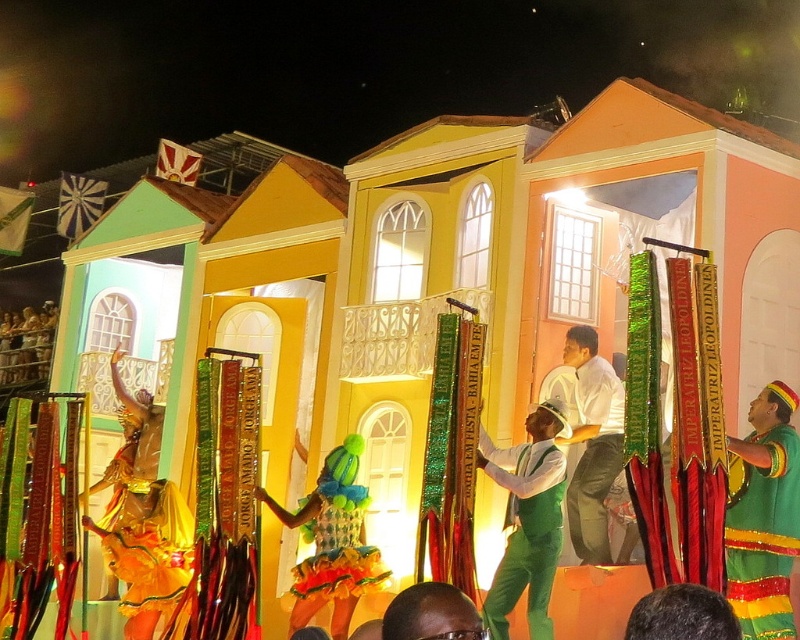
You are a photographer standing at the camera position trying to capture the float. The float has a special decoration at point (540, 604). If your camera has a focal length of 50mm, can you estimate whether this point is within the camera frame?

The point (540, 604) is 47.78 meters away from the camera. Since the focal length of 50mm is suitable for capturing distant objects, the point should be within the camera frame.

You are a photographer at the parade and want to capture both the point at coordinates point (508,570) and point (590,516) in your shot. Since you can only focus on one point at a time, which point should you focus on to ensure the other is still visible in the background?

You should focus on point (508,570) because it is in front of point (590,516). This way, the point (590,516) will naturally appear in the background of the photo.

In the scene shown: You are a photographer at the parade. You want to capture both the green fabric at center and the white glossy shirt at center in a single frame. Which object should you focus on first to ensure both are in the frame?

The green fabric at center is bigger than the white glossy shirt at center, so you should focus on the green fabric at center first to ensure both are in the frame.